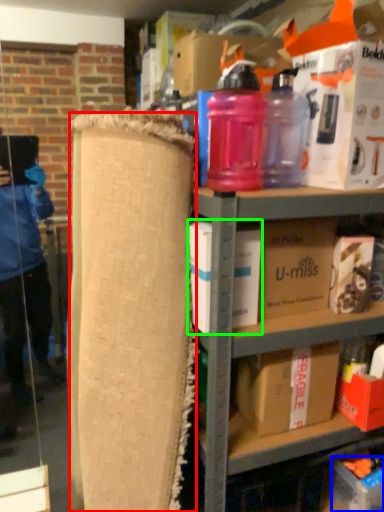
Question: Considering the real-world distances, which object is closest to plywood (highlighted by a red box)? cardboard box (highlighted by a blue box) or box (highlighted by a green box).

Choices:
 (A) cardboard box
 (B) box

Answer: (B)